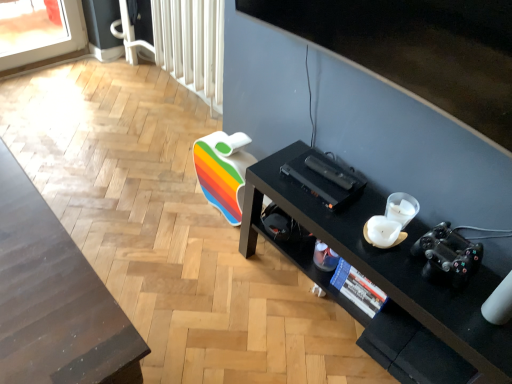
Identify the location of vacant area situated to the left side of white plastic radiator at upper center. (120, 101).